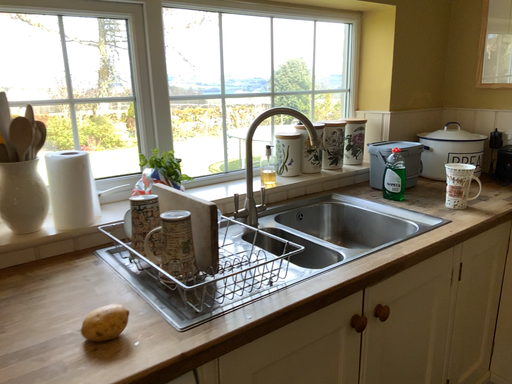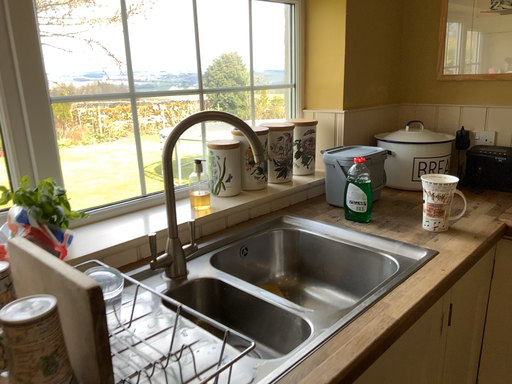
Question: Which way did the camera rotate in the video?

Choices:
 (A) rotated right
 (B) rotated left

Answer: (A)